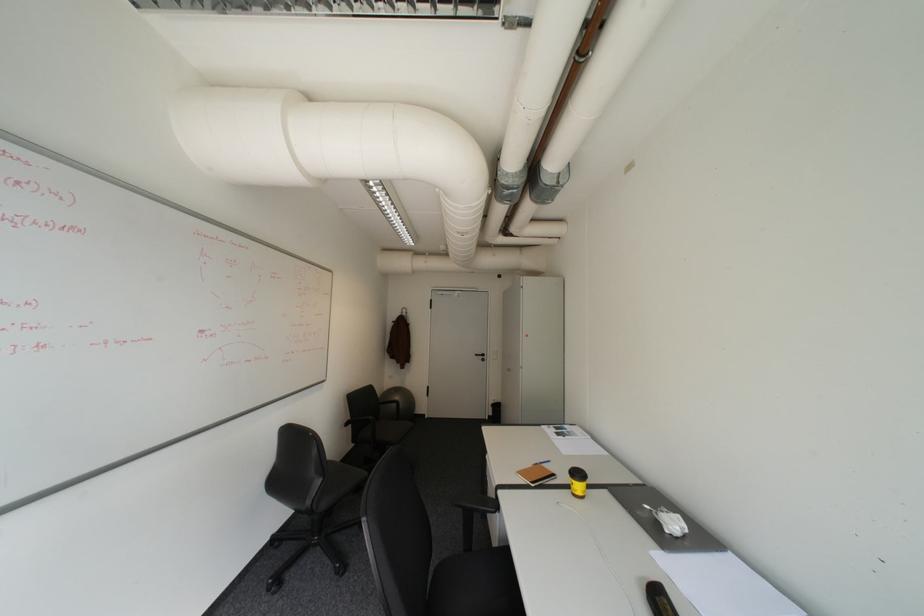
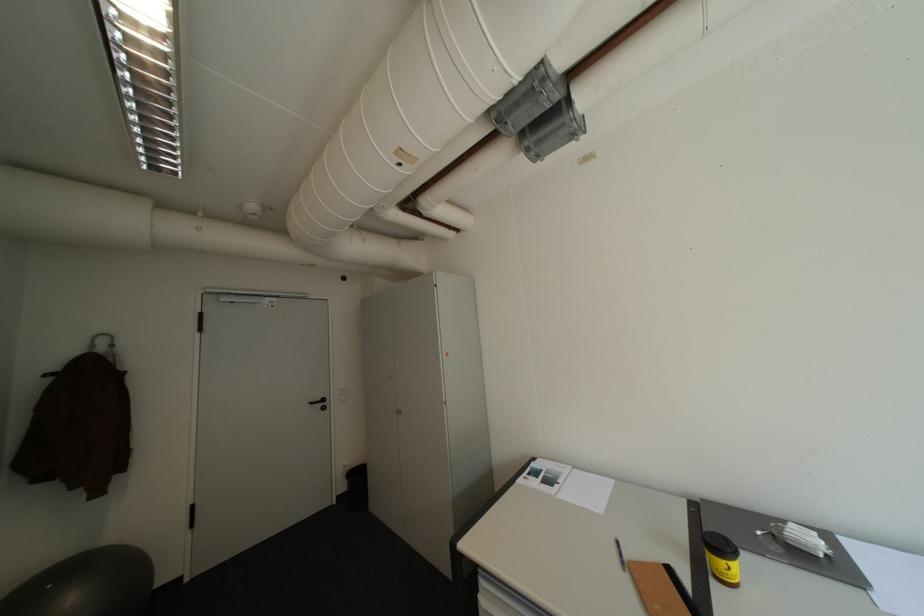
The point at (485,355) is marked in the first image. Where is the corresponding point in the second image?

(321, 403)